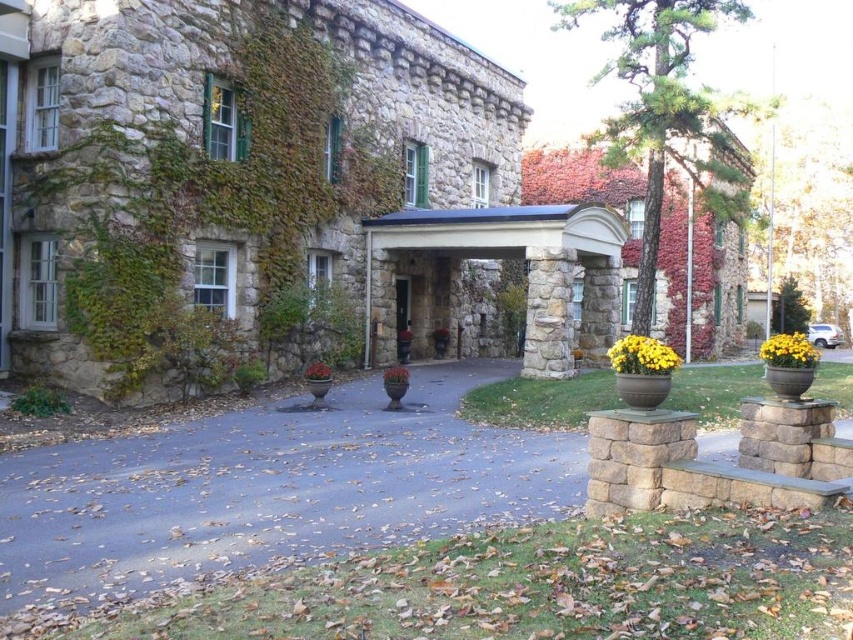
Question: Can you confirm if yellow matte flower pot at center-right is positioned to the left of green matte planter at center?

Choices:
 (A) yes
 (B) no

Answer: (B)

Question: Which point is closer to the camera taking this photo?

Choices:
 (A) (666, 372)
 (B) (321, 365)

Answer: (A)

Question: Does yellow matte flower pot at center come in front of green matte planter at center?

Choices:
 (A) no
 (B) yes

Answer: (B)

Question: Which point is closer to the camera?

Choices:
 (A) (321, 380)
 (B) (769, 353)
 (C) (393, 365)

Answer: (B)

Question: Is yellow matte flower pot at center to the right of yellow matte flower pot at center-right from the viewer's perspective?

Choices:
 (A) yes
 (B) no

Answer: (B)

Question: Estimate the real-world distances between objects in this image. Which object is farther from the green matte planter at center?

Choices:
 (A) yellow matte flower pot at center-right
 (B) yellow matte flower pot at center
 (C) matte ceramic pot at center

Answer: (A)